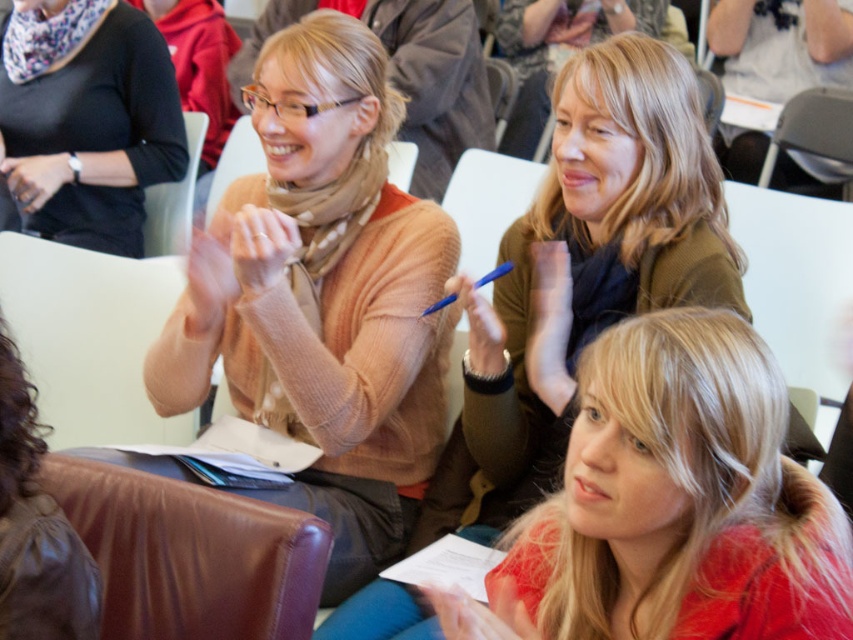
Identify the location of shiny red coat at center. (672, 506).

Does shiny red coat at center have a greater height compared to matte brown sweater at center?

In fact, shiny red coat at center may be shorter than matte brown sweater at center.

What do you see at coordinates (672, 506) in the screenshot?
I see `shiny red coat at center` at bounding box center [672, 506].

Locate an element on the screen. shiny red coat at center is located at coordinates (672, 506).

Does point (461, 516) lie behind point (170, 140)?

No.

Find the location of `matte brown sweater at center`. matte brown sweater at center is located at coordinates (582, 273).

Image resolution: width=853 pixels, height=640 pixels. What do you see at coordinates (582, 273) in the screenshot?
I see `matte brown sweater at center` at bounding box center [582, 273].

In order to click on matte brown sweater at center in this screenshot , I will do `click(582, 273)`.

The image size is (853, 640). Identify the location of matte beige sweater at center. (323, 296).